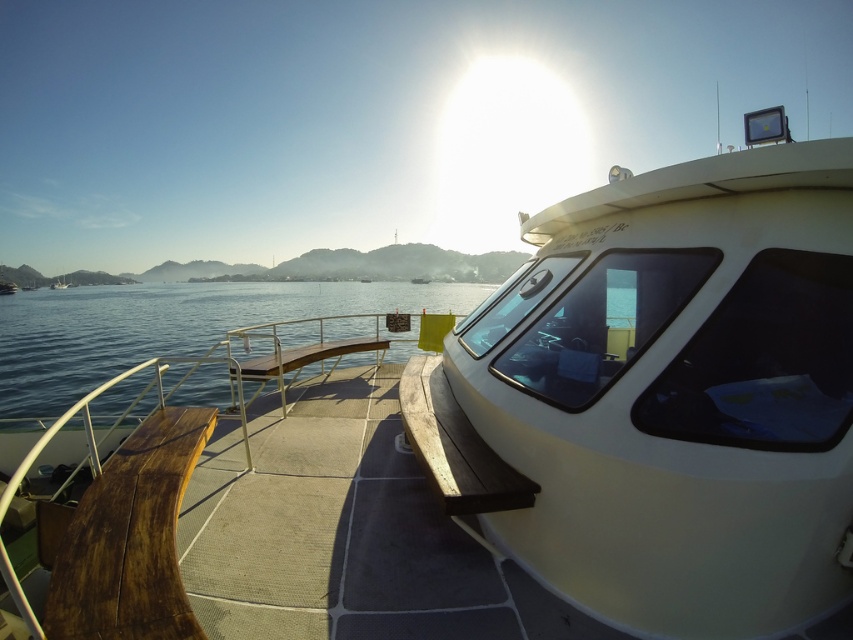
Is white matte boat at right to the left of clear blue water at center from the viewer's perspective?

No, white matte boat at right is not to the left of clear blue water at center.

Does point (689, 480) lie in front of point (412, 333)?

Yes, it is.

Who is more forward, (732, 634) or (299, 326)?

Point (732, 634)

You are a GUI agent. You are given a task and a screenshot of the screen. Output one action in this format:
    pyautogui.click(x=<x>, y=<y>)
    Task: Click on the white matte boat at right
    
    Given the screenshot: What is the action you would take?
    pyautogui.click(x=664, y=396)